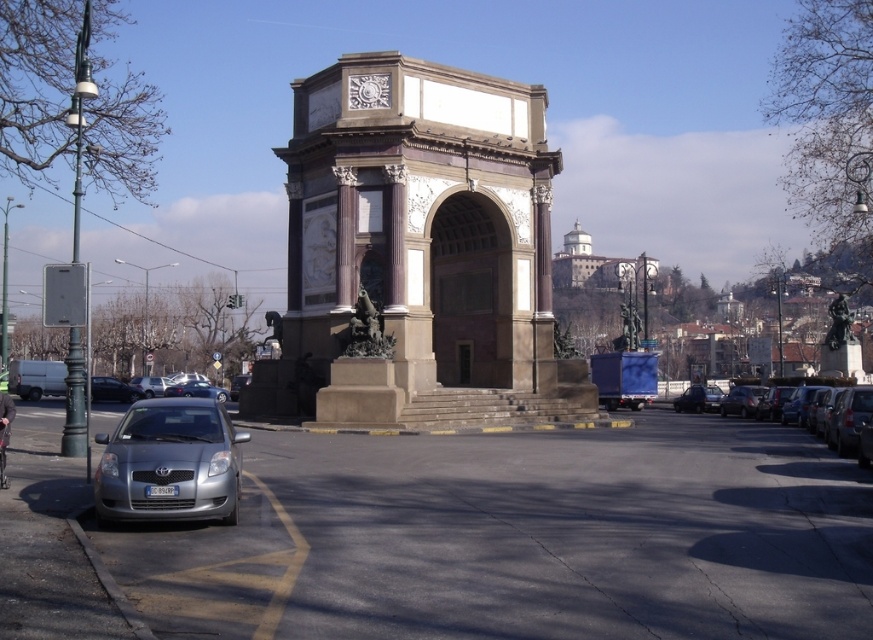
Between point (430, 68) and point (155, 406), which one is positioned behind?

Positioned behind is point (430, 68).

Can you confirm if brown stone arch at center is positioned below silver metallic car at lower left?

Incorrect, brown stone arch at center is not positioned below silver metallic car at lower left.

Identify the location of brown stone arch at center. The height and width of the screenshot is (640, 873). (418, 252).

Where is `brown stone arch at center`? Image resolution: width=873 pixels, height=640 pixels. brown stone arch at center is located at coordinates (418, 252).

Is bronze statue at center further to the viewer compared to bronze statue at right?

No, it is not.

Does bronze statue at center have a lesser width compared to bronze statue at right?

Yes.

Which is behind, point (361, 340) or point (835, 339)?

The point (835, 339) is more distant.

You are a GUI agent. You are given a task and a screenshot of the screen. Output one action in this format:
    pyautogui.click(x=<x>, y=<y>)
    Task: Click on the bronze statue at center
    
    Given the screenshot: What is the action you would take?
    pyautogui.click(x=365, y=330)

Who is taller, silver metallic car at lower left or bronze statue at center?

bronze statue at center

Who is higher up, silver metallic car at lower left or bronze statue at center?

bronze statue at center

Where is `silver metallic car at lower left`? The image size is (873, 640). silver metallic car at lower left is located at coordinates (169, 464).